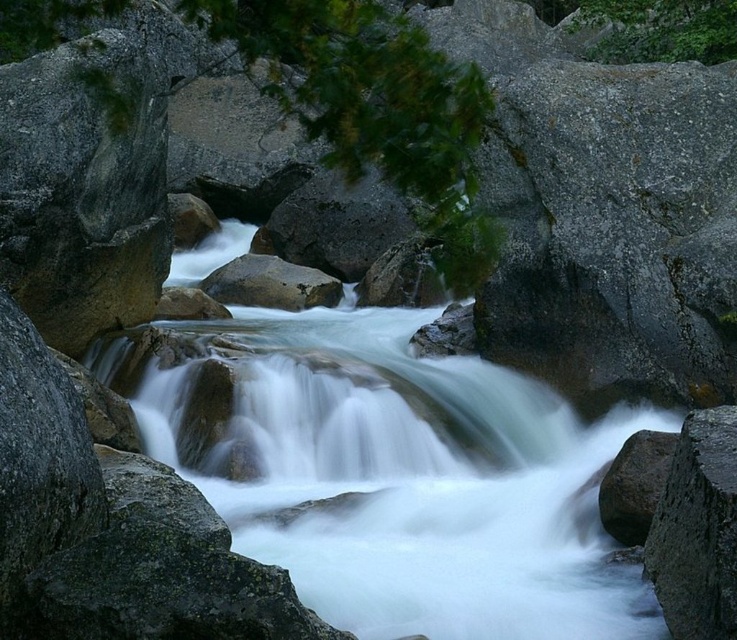
Does point (279, 20) lie in front of point (694, 486)?

Yes, it is.

Does point (296, 36) come farther from viewer compared to point (710, 554)?

No, it is not.

Which is in front, point (482, 113) or point (677, 588)?

Positioned in front is point (677, 588).

This screenshot has height=640, width=737. I want to click on green leafy tree at center, so click(373, 106).

Looking at this image, does white smooth water at center have a greater height compared to smooth gray rock at center?

Yes, white smooth water at center is taller than smooth gray rock at center.

Does white smooth water at center have a lesser height compared to smooth gray rock at center?

No, white smooth water at center is not shorter than smooth gray rock at center.

I want to click on white smooth water at center, so click(415, 484).

Does green leafy tree at center have a greater height compared to smooth gray rock at center?

Correct, green leafy tree at center is much taller as smooth gray rock at center.

Is green leafy tree at center positioned in front of smooth gray rock at center?

Yes, it is.

Is point (356, 132) more distant than point (262, 284)?

No.

Locate an element on the screen. green leafy tree at center is located at coordinates (373, 106).